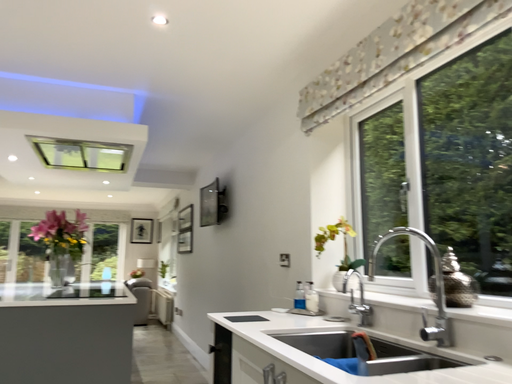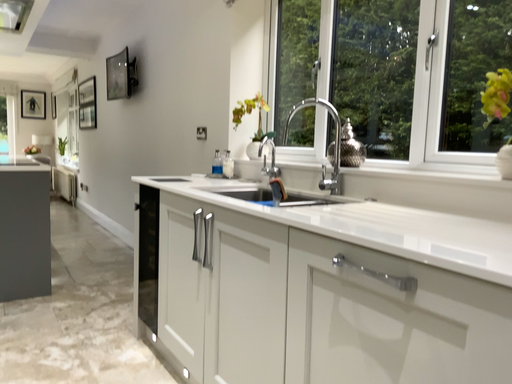
Question: How did the camera likely rotate when shooting the video?

Choices:
 (A) rotated left
 (B) rotated right

Answer: (B)